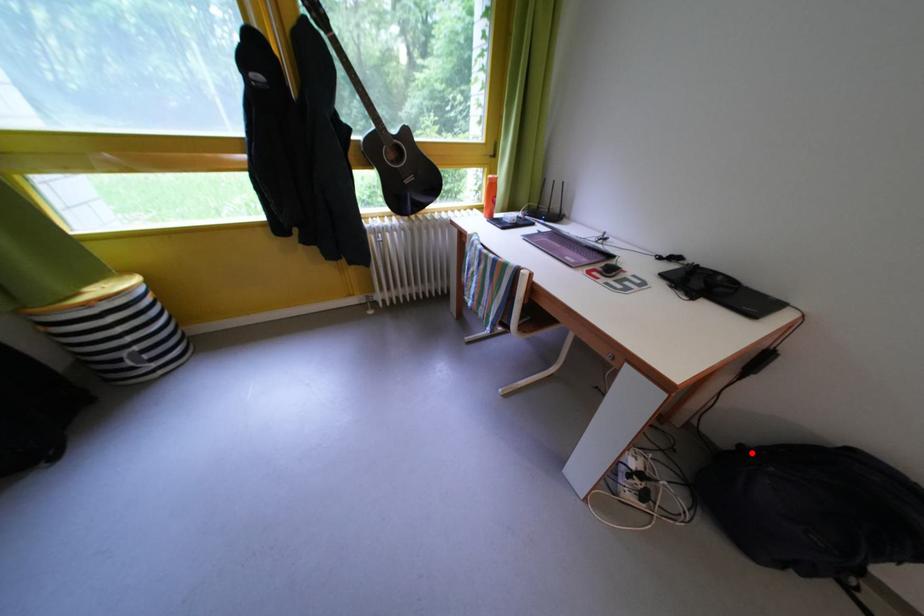
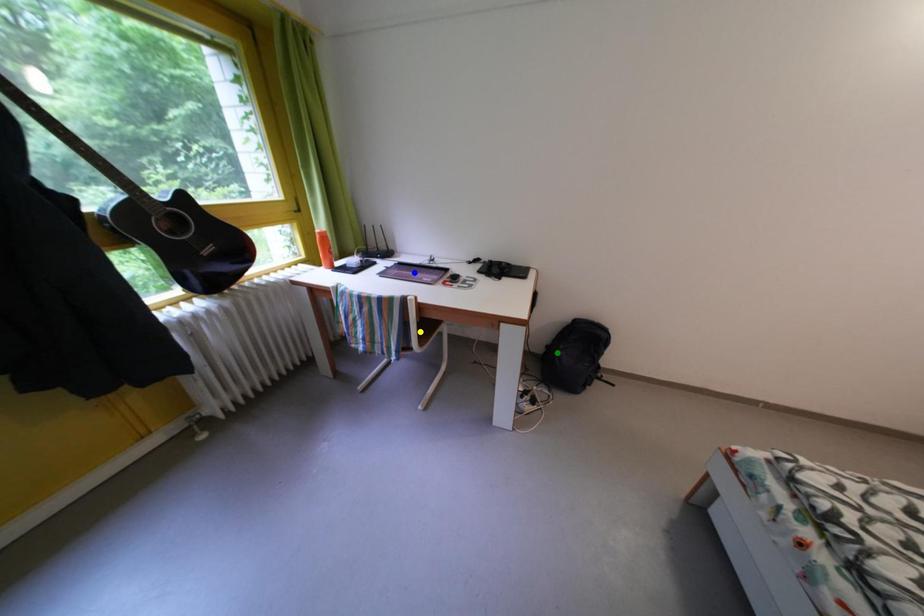
Question: I am providing you with two images of the same scene from different viewpoints. A red point is marked on the first image. You are given multiple points on the second image. Which spot in image 2 lines up with the point in image 1?

Choices:
 (A) blue point
 (B) yellow point
 (C) green point

Answer: (C)